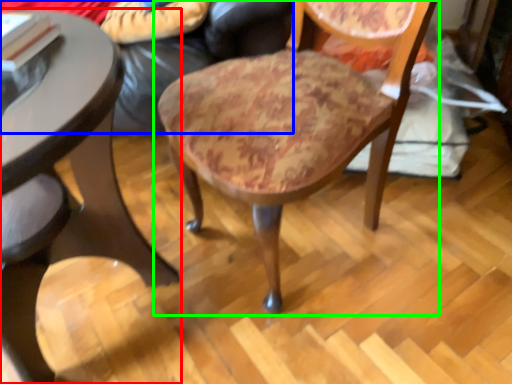
Question: Which is nearer to the table (highlighted by a red box)? couch (highlighted by a blue box) or chair (highlighted by a green box).

Choices:
 (A) couch
 (B) chair

Answer: (B)